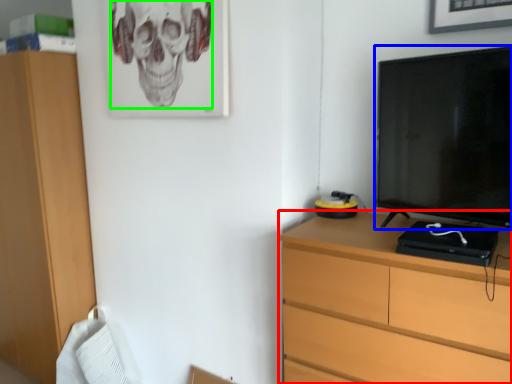
Question: Based on their relative distances, which object is nearer to chest of drawers (highlighted by a red box)? Choose from television (highlighted by a blue box) and skull (highlighted by a green box).

Choices:
 (A) television
 (B) skull

Answer: (A)